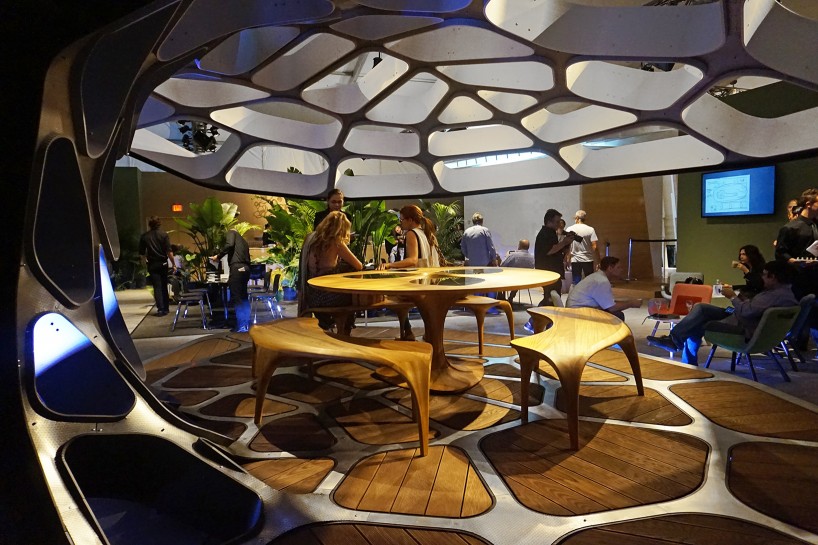
Find the location of a particular element. The width and height of the screenshot is (818, 545). man wearing white shirt, sitting in chair is located at coordinates (590, 284), (609, 286).